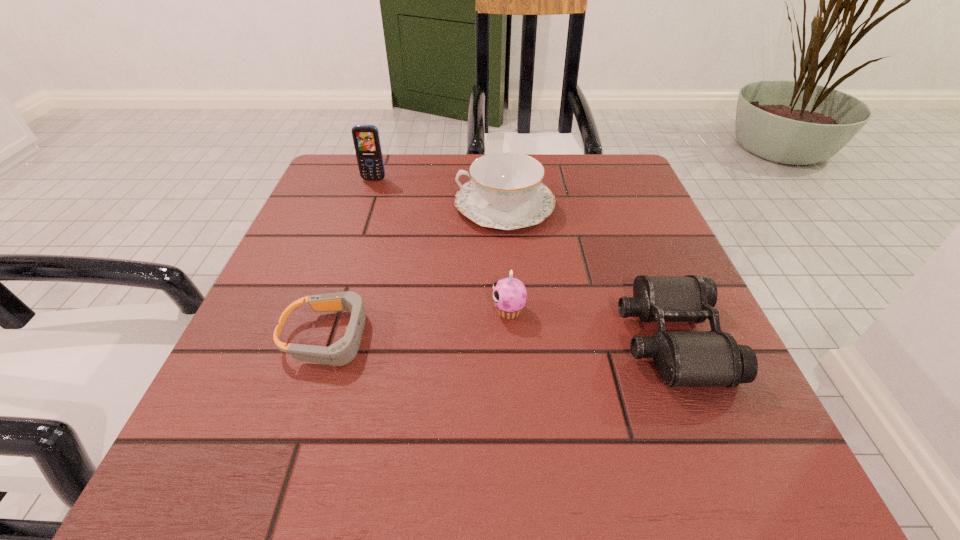
At what (x,y) coordinates should I click in order to perform the action: click on cellular telephone. Please return your answer as a coordinate pair (x, y). The image size is (960, 540). Looking at the image, I should click on (366, 139).

Where is `cupcake`? This screenshot has height=540, width=960. cupcake is located at coordinates (509, 294).

What are the coordinates of `chinaware` in the screenshot? It's located at (505, 191).

Locate an element on the screen. the second shortest object is located at coordinates (683, 358).

Locate an element on the screen. binoculars is located at coordinates (683, 358).

I want to click on goggles, so click(342, 352).

You are a GUI agent. You are given a task and a screenshot of the screen. Output one action in this format:
    pyautogui.click(x=<x>, y=<y>)
    Task: Click on the vacant region located on the screen of the cellular telephone
    This screenshot has height=540, width=960.
    Given the screenshot: What is the action you would take?
    pyautogui.click(x=358, y=227)

Find the location of a particular element. vacant space situated on the face of the cupcake is located at coordinates (345, 310).

Identify the location of free space located 0.160m on the face of the cupcake. (398, 310).

Where is `vacant space located 0.210m on the face of the cupcake`? This screenshot has height=540, width=960. vacant space located 0.210m on the face of the cupcake is located at coordinates (369, 310).